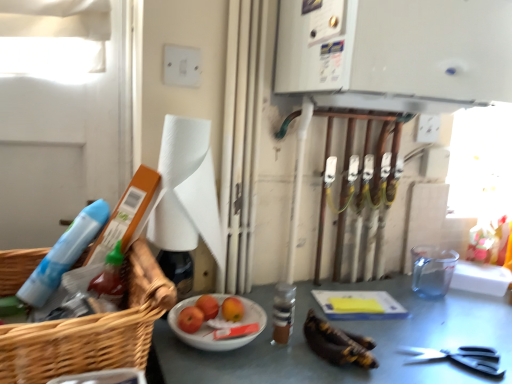
Question: Should I look upward or downward to see blue plastic spray bottle at left?

Choices:
 (A) up
 (B) down

Answer: (B)

Question: Does brown glass bottle at center have a larger size compared to white paper towel at center?

Choices:
 (A) yes
 (B) no

Answer: (B)

Question: Is the position of brown glass bottle at center more distant than that of white paper towel at center?

Choices:
 (A) no
 (B) yes

Answer: (B)

Question: Is brown glass bottle at center oriented away from white paper towel at center?

Choices:
 (A) yes
 (B) no

Answer: (B)

Question: From a real-world perspective, is brown glass bottle at center physically below white paper towel at center?

Choices:
 (A) no
 (B) yes

Answer: (B)

Question: Is brown glass bottle at center oriented towards white paper towel at center?

Choices:
 (A) yes
 (B) no

Answer: (B)

Question: Does brown glass bottle at center lie in front of white paper towel at center?

Choices:
 (A) yes
 (B) no

Answer: (B)

Question: From the image's perspective, does shiny red apples at center, which is counted as the 2th fruit, starting from the back, appear lower than brown glass bottle at center?

Choices:
 (A) yes
 (B) no

Answer: (A)

Question: Is shiny red apples at center, which is counted as the 2th fruit, starting from the back, with brown glass bottle at center?

Choices:
 (A) yes
 (B) no

Answer: (B)

Question: Does shiny red apples at center, which is counted as the 2th fruit, starting from the back, lie in front of brown glass bottle at center?

Choices:
 (A) no
 (B) yes

Answer: (A)

Question: Can you confirm if shiny red apples at center, which ranks as the first fruit in front-to-back order, is wider than brown glass bottle at center?

Choices:
 (A) no
 (B) yes

Answer: (A)

Question: Would you say shiny red apples at center, which is counted as the 2th fruit, starting from the back, contains brown glass bottle at center?

Choices:
 (A) yes
 (B) no

Answer: (B)

Question: Considering the relative sizes of shiny red apples at center, which ranks as the first fruit in front-to-back order, and brown glass bottle at center in the image provided, is shiny red apples at center, which ranks as the first fruit in front-to-back order, taller than brown glass bottle at center?

Choices:
 (A) no
 (B) yes

Answer: (A)

Question: From the image's perspective, would you say shiny red apples at center, which ranks as the first fruit in front-to-back order, is shown under smooth red apple at center, which is counted as the first fruit, starting from the back?

Choices:
 (A) yes
 (B) no

Answer: (A)